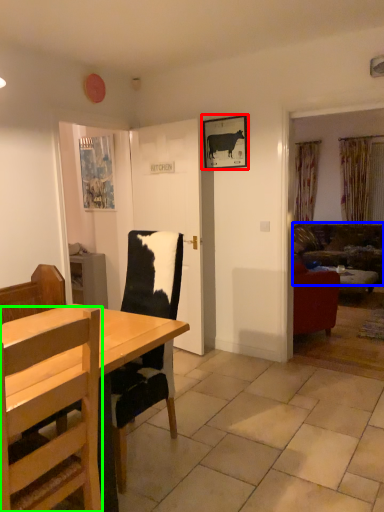
Question: Which object is the closest to the picture frame (highlighted by a red box)? Choose among these: studio couch (highlighted by a blue box) or chair (highlighted by a green box).

Choices:
 (A) studio couch
 (B) chair

Answer: (B)